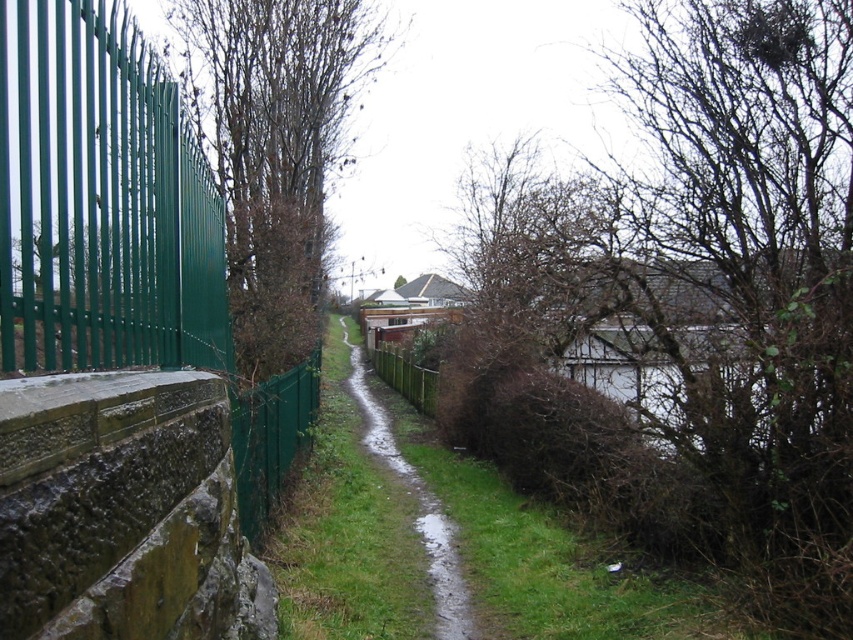
Question: Which object is positioned farthest from the green grass at center?

Choices:
 (A) green metal fence at left
 (B) brown leafless tree at left
 (C) wet grass at center

Answer: (A)

Question: Does green metal fence at left come behind green grass at center?

Choices:
 (A) no
 (B) yes

Answer: (A)

Question: Does green metal fence at left appear under wet grass at center?

Choices:
 (A) no
 (B) yes

Answer: (A)

Question: From the image, what is the correct spatial relationship of green grass at center in relation to brown leafless tree at left?

Choices:
 (A) below
 (B) above

Answer: (A)

Question: Which object is the farthest from the brown leafless tree at left?

Choices:
 (A) green grass at center
 (B) wet grass at center

Answer: (B)

Question: Which of the following is the farthest from the observer?

Choices:
 (A) (334, 372)
 (B) (282, 198)
 (C) (204, 342)
 (D) (413, 477)

Answer: (A)